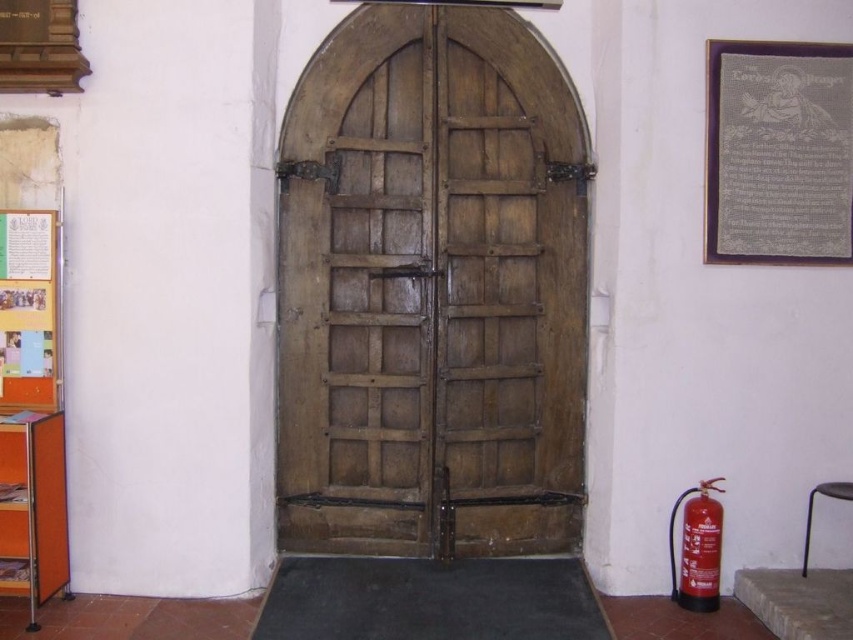
Is silver metallic plaque at upper right shorter than multicolored paper at left?

No, silver metallic plaque at upper right is not shorter than multicolored paper at left.

Image resolution: width=853 pixels, height=640 pixels. What do you see at coordinates (778, 152) in the screenshot?
I see `silver metallic plaque at upper right` at bounding box center [778, 152].

Locate an element on the screen. silver metallic plaque at upper right is located at coordinates (778, 152).

Consider the image. Measure the distance between point (509,387) and camera.

Point (509,387) is 4.00 meters from camera.

Is wooden door at center positioned at the back of metallic gray stool at lower right?

Yes, it is.

Is point (303, 108) behind point (840, 483)?

That is True.

Find the location of a particular element. The width and height of the screenshot is (853, 640). wooden door at center is located at coordinates (431, 289).

Is point (13, 355) more distant than point (804, 552)?

No, (13, 355) is closer to viewer.

Find the location of a particular element. The width and height of the screenshot is (853, 640). multicolored paper at left is located at coordinates (27, 308).